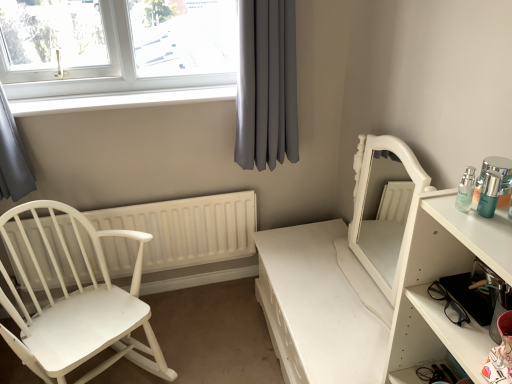
Question: From a real-world perspective, is white glossy mirror at right on top of gray fabric curtain at upper center?

Choices:
 (A) no
 (B) yes

Answer: (A)

Question: Is white glossy mirror at right bigger than gray fabric curtain at upper center?

Choices:
 (A) yes
 (B) no

Answer: (A)

Question: Would you say white glossy mirror at right is a long distance from gray fabric curtain at upper center?

Choices:
 (A) yes
 (B) no

Answer: (B)

Question: Can you confirm if white glossy mirror at right is shorter than gray fabric curtain at upper center?

Choices:
 (A) no
 (B) yes

Answer: (B)

Question: Is white glossy mirror at right positioned in front of gray fabric curtain at upper center?

Choices:
 (A) yes
 (B) no

Answer: (A)

Question: Is white glossy shelf at right bigger or smaller than white glossy window sill at upper left?

Choices:
 (A) big
 (B) small

Answer: (A)

Question: From the image's perspective, relative to white glossy window sill at upper left, is white glossy shelf at right above or below?

Choices:
 (A) below
 (B) above

Answer: (A)

Question: From their relative heights in the image, would you say white glossy shelf at right is taller or shorter than white glossy window sill at upper left?

Choices:
 (A) short
 (B) tall

Answer: (B)

Question: In terms of width, does white glossy shelf at right look wider or thinner when compared to white glossy window sill at upper left?

Choices:
 (A) thin
 (B) wide

Answer: (B)

Question: Would you say white glossy shelf at right is inside or outside white wood chair at left?

Choices:
 (A) inside
 (B) outside

Answer: (B)

Question: Is point (403, 327) positioned closer to the camera than point (102, 342)?

Choices:
 (A) farther
 (B) closer

Answer: (B)

Question: Looking at the image, does white glossy shelf at right seem bigger or smaller compared to white wood chair at left?

Choices:
 (A) big
 (B) small

Answer: (B)

Question: In terms of width, does white glossy shelf at right look wider or thinner when compared to white wood chair at left?

Choices:
 (A) wide
 (B) thin

Answer: (B)

Question: Looking at the image, does gray fabric curtain at upper center seem bigger or smaller compared to matte glass bottles at right?

Choices:
 (A) small
 (B) big

Answer: (B)

Question: In the image, is gray fabric curtain at upper center on the left side or the right side of matte glass bottles at right?

Choices:
 (A) left
 (B) right

Answer: (A)